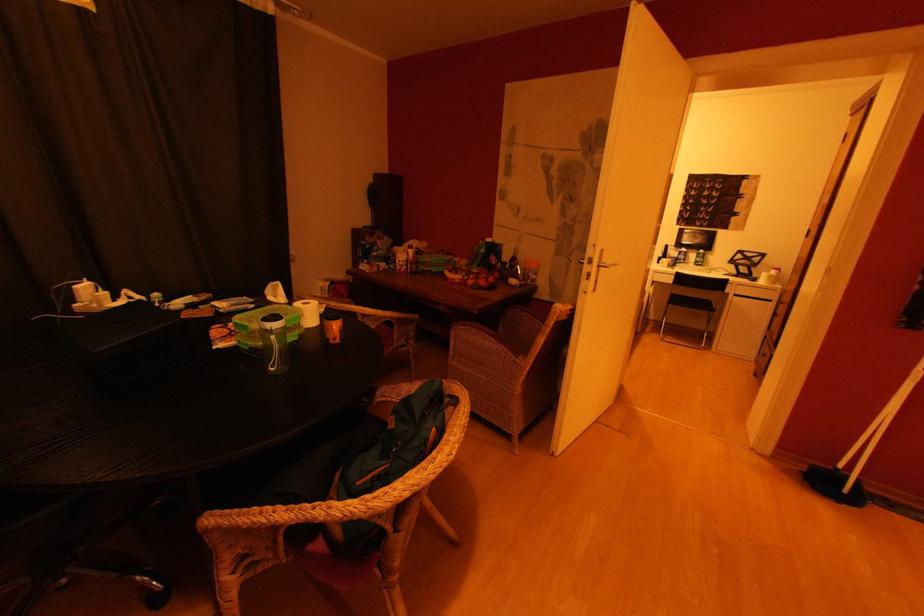
You are a GUI agent. You are given a task and a screenshot of the screen. Output one action in this format:
    pyautogui.click(x=<x>, y=<y>)
    Task: Click on the silver door handle
    
    Given the screenshot: What is the action you would take?
    pyautogui.click(x=594, y=265)